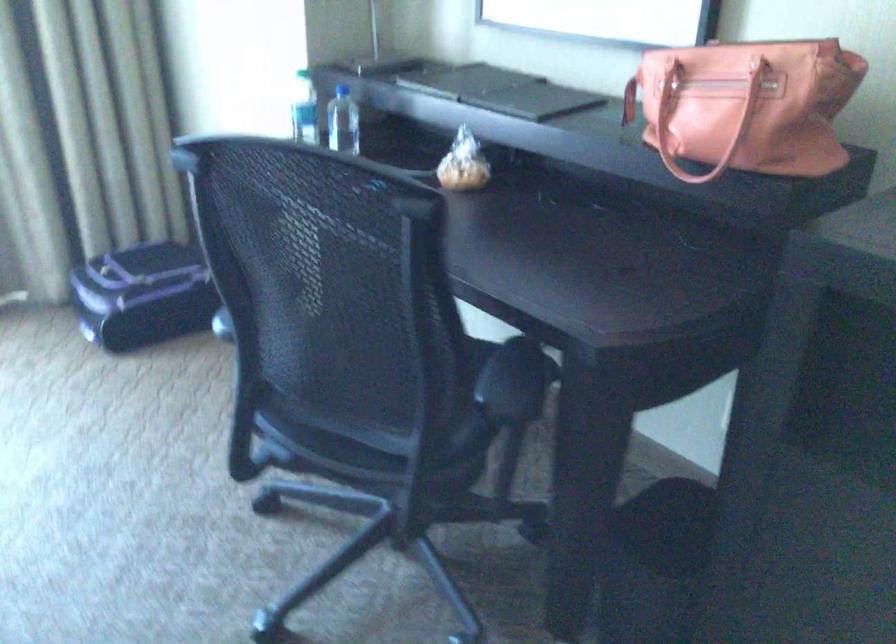
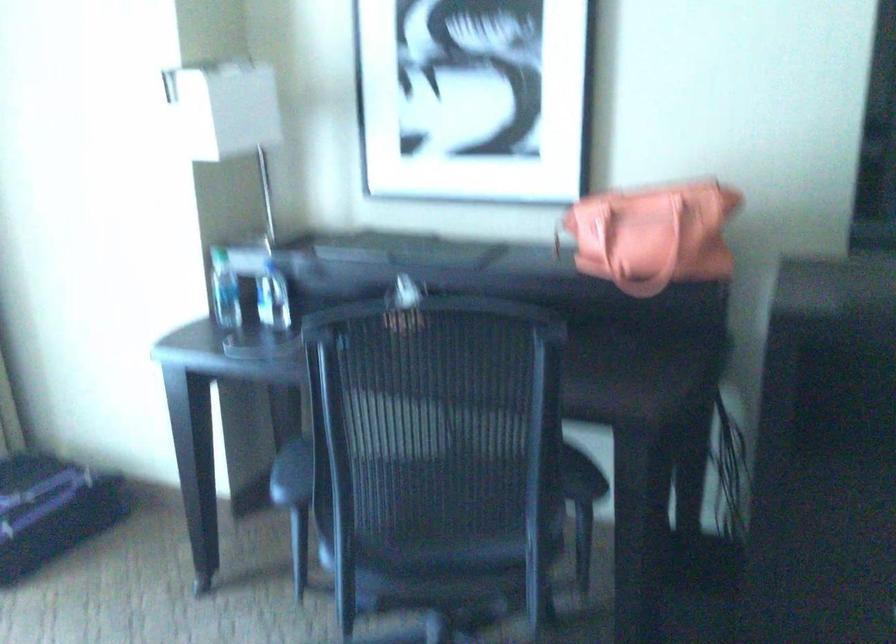
Where in the second image is the point corresponding to (366,422) from the first image?

(458, 544)